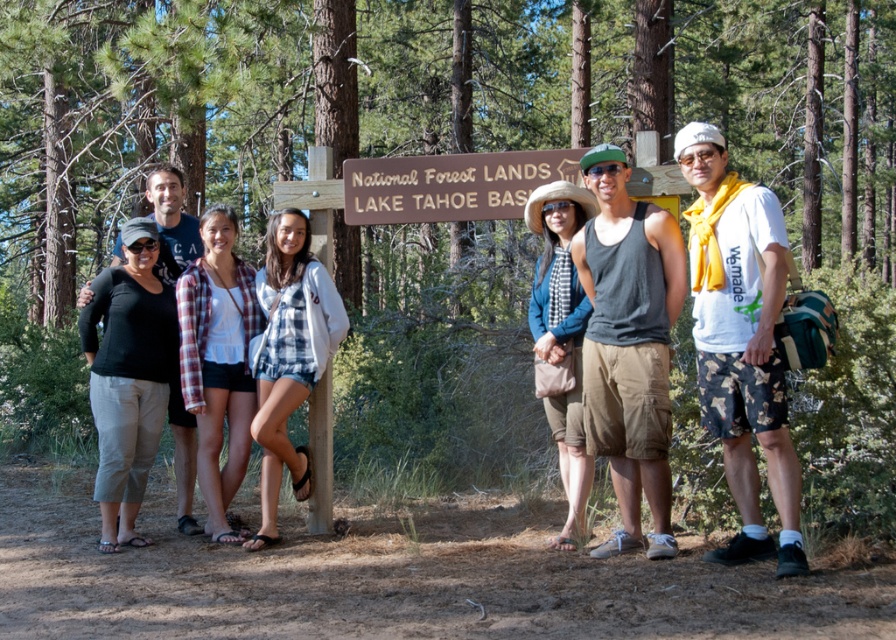
Which is more to the right, white cotton t-shirt at center or brown wooden sign at center?

Positioned to the right is white cotton t-shirt at center.

Is white cotton t-shirt at center positioned behind brown wooden sign at center?

That is False.

Is point (734, 316) farther from camera compared to point (429, 177)?

No, it is in front of (429, 177).

Locate an element on the screen. Image resolution: width=896 pixels, height=640 pixels. white cotton t-shirt at center is located at coordinates (741, 342).

Which is more to the right, brown dirt trail at lower center or white cotton t-shirt at center?

Positioned to the right is white cotton t-shirt at center.

Is brown dirt trail at lower center taller than white cotton t-shirt at center?

Incorrect, brown dirt trail at lower center's height is not larger of white cotton t-shirt at center's.

Does point (777, 602) come behind point (705, 276)?

No, it is not.

In order to click on brown dirt trail at lower center in this screenshot , I will do `click(392, 577)`.

Consider the image. Who is more distant from viewer, (128, 560) or (579, 173)?

Point (579, 173)

Identify the location of brown dirt trail at lower center. coord(392,577).

Between point (718, 602) and point (479, 156), which one is positioned behind?

The point (479, 156) is more distant.

Find the location of a particular element. brown dirt trail at lower center is located at coordinates (392, 577).